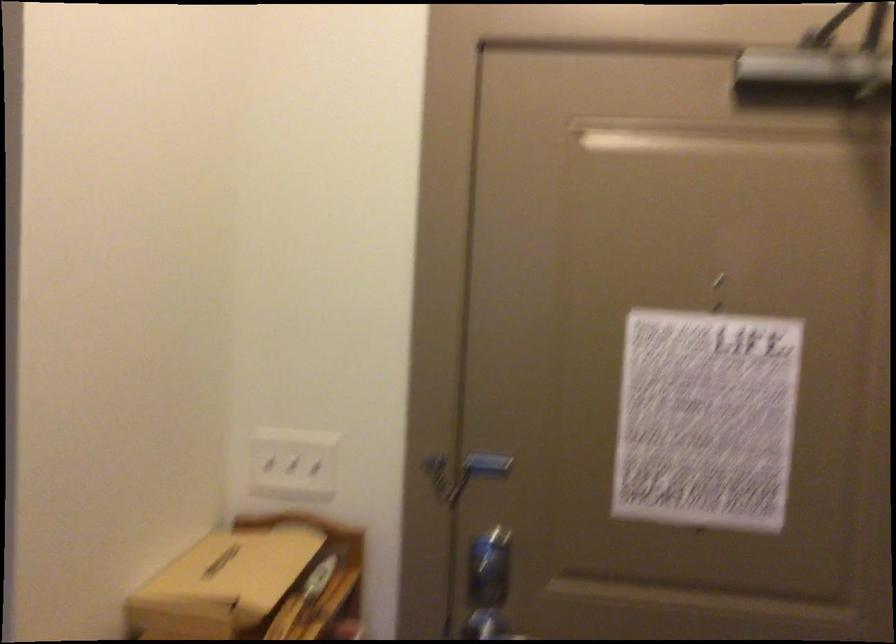
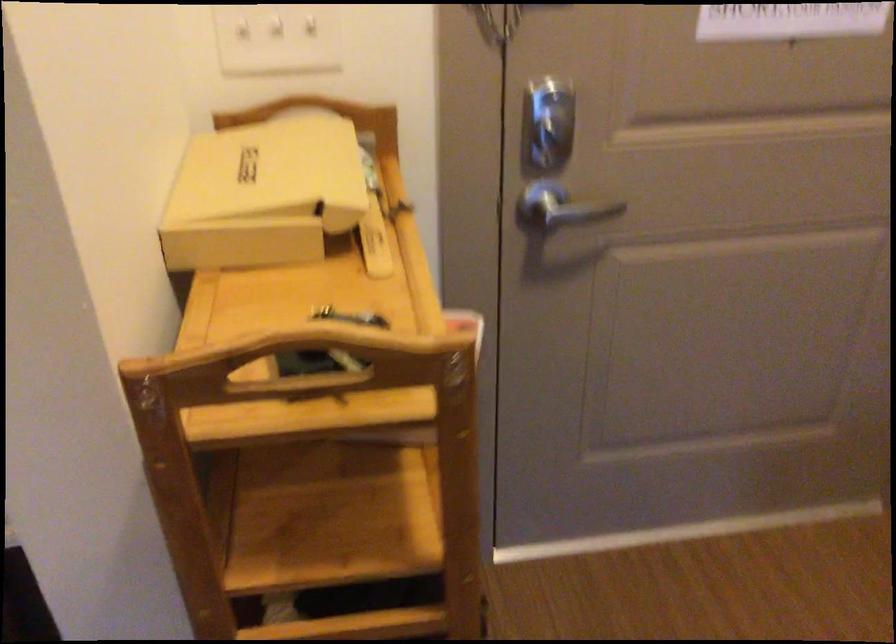
Question: How did the camera likely rotate?

Choices:
 (A) Left
 (B) Right
 (C) Up
 (D) Down

Answer: (D)